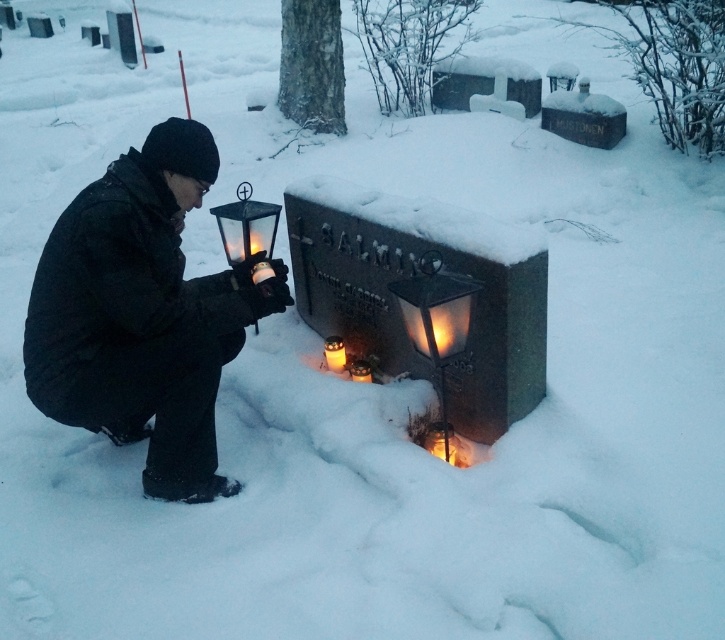
Is point (94, 220) farther from camera compared to point (334, 356)?

No.

Identify the location of black matte lantern at left. This screenshot has width=725, height=640. (141, 314).

What do you see at coordinates (141, 314) in the screenshot?
I see `black matte lantern at left` at bounding box center [141, 314].

Where is `black matte lantern at left`? This screenshot has height=640, width=725. black matte lantern at left is located at coordinates (141, 314).

Can you confirm if translucent glass lantern at center is taller than matte glass lantern at center?

Indeed, translucent glass lantern at center has a greater height compared to matte glass lantern at center.

Is translucent glass lantern at center smaller than matte glass lantern at center?

Incorrect, translucent glass lantern at center is not smaller in size than matte glass lantern at center.

What do you see at coordinates (436, 320) in the screenshot? The height and width of the screenshot is (640, 725). I see `translucent glass lantern at center` at bounding box center [436, 320].

Locate an element on the screen. This screenshot has width=725, height=640. translucent glass lantern at center is located at coordinates (436, 320).

Is point (112, 230) positioned in front of point (426, 256)?

That is True.

Can you confirm if black matte lantern at left is positioned below matte glass lantern at center?

Correct, black matte lantern at left is located below matte glass lantern at center.

Locate an element on the screen. black matte lantern at left is located at coordinates (141, 314).